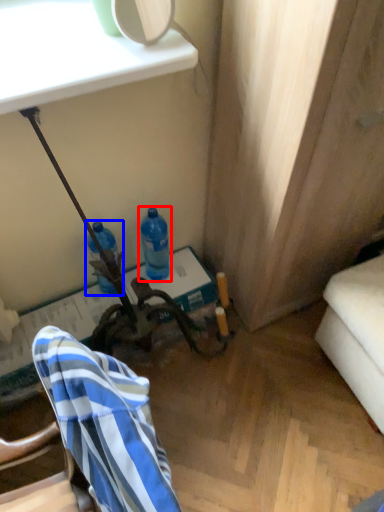
Question: Among these objects, which one is farthest to the camera, bottle (highlighted by a red box) or bottle (highlighted by a blue box)?

Choices:
 (A) bottle
 (B) bottle

Answer: (A)